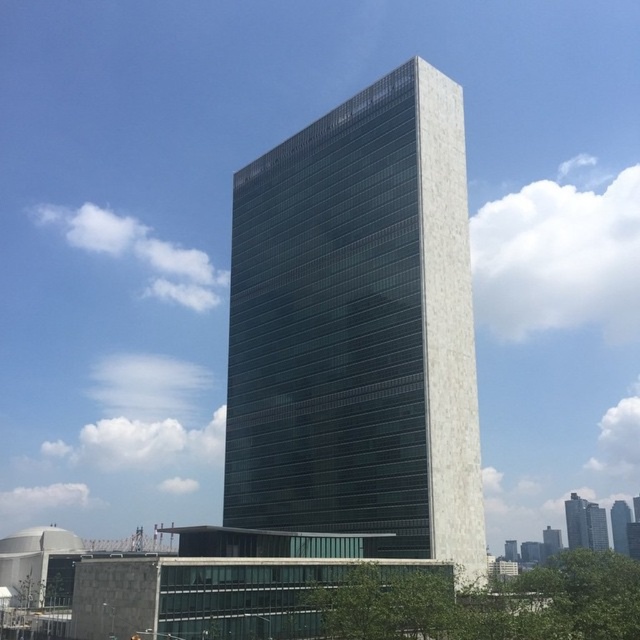
The image size is (640, 640). Identify the location of glassy reflective skyscraper at center. (577, 522).

Between glassy reflective skyscraper at center and white marble tower at center, which one appears on the right side from the viewer's perspective?

From the viewer's perspective, white marble tower at center appears more on the right side.

Between point (582, 531) and point (605, 531), which one is positioned in front?

Point (582, 531) is in front.

The image size is (640, 640). What are the coordinates of `glassy reflective skyscraper at center` in the screenshot? It's located at (577, 522).

Which of these two, matte glass tower at center or white marble tower at center, stands taller?

With more height is matte glass tower at center.

Is matte glass tower at center in front of white marble tower at center?

Yes.

Where is `matte glass tower at center`? The width and height of the screenshot is (640, 640). matte glass tower at center is located at coordinates (358, 326).

Who is positioned more to the right, white marble tower at center or green glass skyscraper at center?

From the viewer's perspective, green glass skyscraper at center appears more on the right side.

Which is behind, point (595, 520) or point (616, 540)?

Positioned behind is point (616, 540).

Find the location of `white marble tower at center`. white marble tower at center is located at coordinates (596, 528).